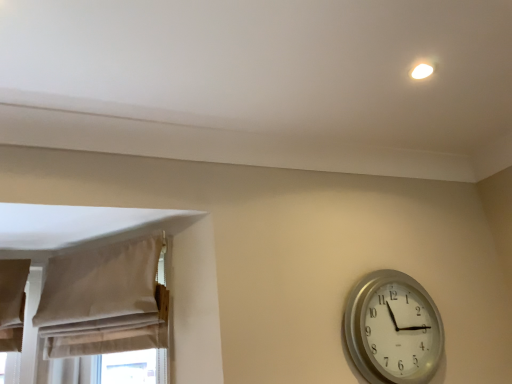
Question: From the image's perspective, does beige fabric curtain at left appear lower than silver metallic wall clock at lower right?

Choices:
 (A) no
 (B) yes

Answer: (A)

Question: From the image's perspective, does beige fabric curtain at left appear higher than silver metallic wall clock at lower right?

Choices:
 (A) yes
 (B) no

Answer: (A)

Question: From a real-world perspective, is beige fabric curtain at left under silver metallic wall clock at lower right?

Choices:
 (A) yes
 (B) no

Answer: (B)

Question: Considering the relative sizes of beige fabric curtain at left and silver metallic wall clock at lower right in the image provided, is beige fabric curtain at left taller than silver metallic wall clock at lower right?

Choices:
 (A) no
 (B) yes

Answer: (A)

Question: Is beige fabric curtain at left not within silver metallic wall clock at lower right?

Choices:
 (A) no
 (B) yes

Answer: (B)

Question: Can silver metallic wall clock at lower right be found inside beige fabric curtain at left?

Choices:
 (A) no
 (B) yes

Answer: (A)

Question: Considering the relative sizes of silver metallic wall clock at lower right and beige fabric curtain at left in the image provided, is silver metallic wall clock at lower right bigger than beige fabric curtain at left?

Choices:
 (A) no
 (B) yes

Answer: (A)

Question: Does silver metallic wall clock at lower right have a smaller size compared to beige fabric curtain at left?

Choices:
 (A) no
 (B) yes

Answer: (B)

Question: Is silver metallic wall clock at lower right aimed at beige fabric curtain at left?

Choices:
 (A) yes
 (B) no

Answer: (B)

Question: From a real-world perspective, is silver metallic wall clock at lower right on beige fabric curtain at left?

Choices:
 (A) yes
 (B) no

Answer: (B)

Question: Is silver metallic wall clock at lower right wider than beige fabric curtain at left?

Choices:
 (A) yes
 (B) no

Answer: (B)

Question: Is silver metallic wall clock at lower right positioned behind beige fabric curtain at left?

Choices:
 (A) yes
 (B) no

Answer: (A)

Question: Considering the relative positions of beige fabric curtain at left and silver metallic wall clock at lower right in the image provided, is beige fabric curtain at left to the left or to the right of silver metallic wall clock at lower right?

Choices:
 (A) left
 (B) right

Answer: (A)